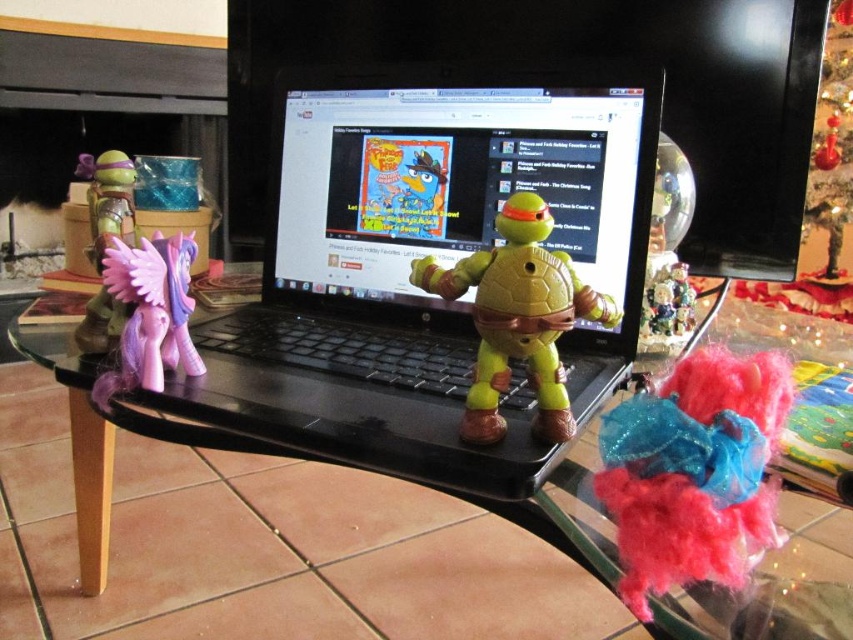
You are organizing a toy display on the table and need to place a new rectangular box that is 12 inches wide. The box must fit between the fuzzy fabric toy at lower right and the matte purple plastic pony at left without overlapping either. Given their widths, can the box fit in the space between them?

The fuzzy fabric toy at lower right is wider than the matte purple plastic pony at left. However, the combined width of both toys would determine the available space between them. Since the box is 12 inches wide, we need to know the exact widths of the toys to calculate the remaining space. Without specific measurements, it is impossible to determine if the box will fit.

Consider the image. You are a delivery robot trying to place a small package on the glass table. The package must be placed exactly at point [421,272]. However, there are obstacles on the table. Based on the image description, can you place the package at that point without it overlapping any objects?

The point [421,272] is on the black plastic laptop at center, so placing the package there would overlap with the laptop. Choose another location on the glass table away from the laptop.